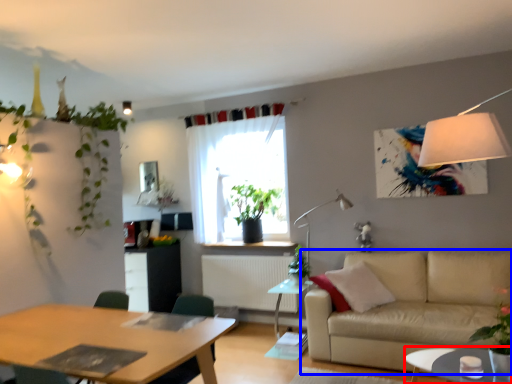
Question: Which object appears closest to the camera in this image, coffee table (highlighted by a red box) or studio couch (highlighted by a blue box)?

Choices:
 (A) coffee table
 (B) studio couch

Answer: (A)